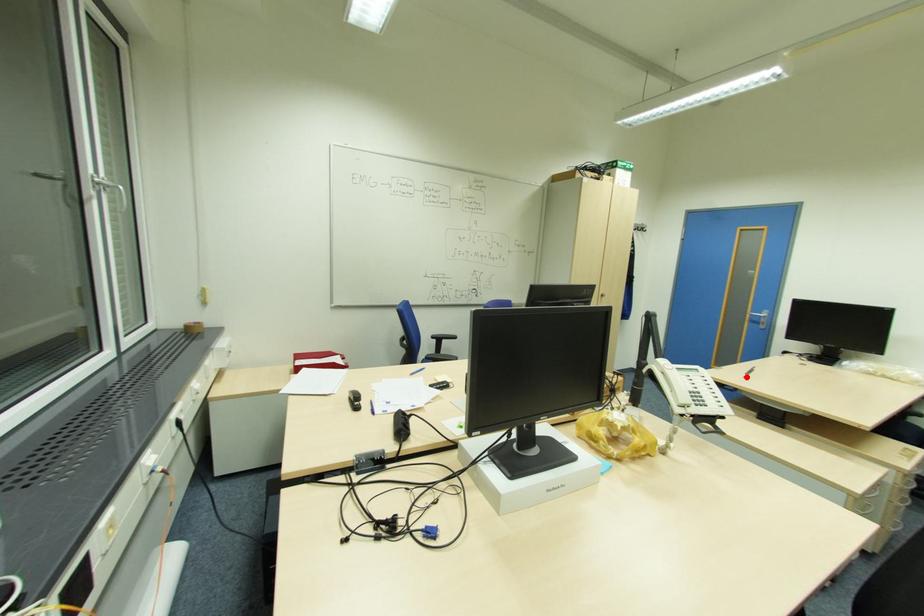
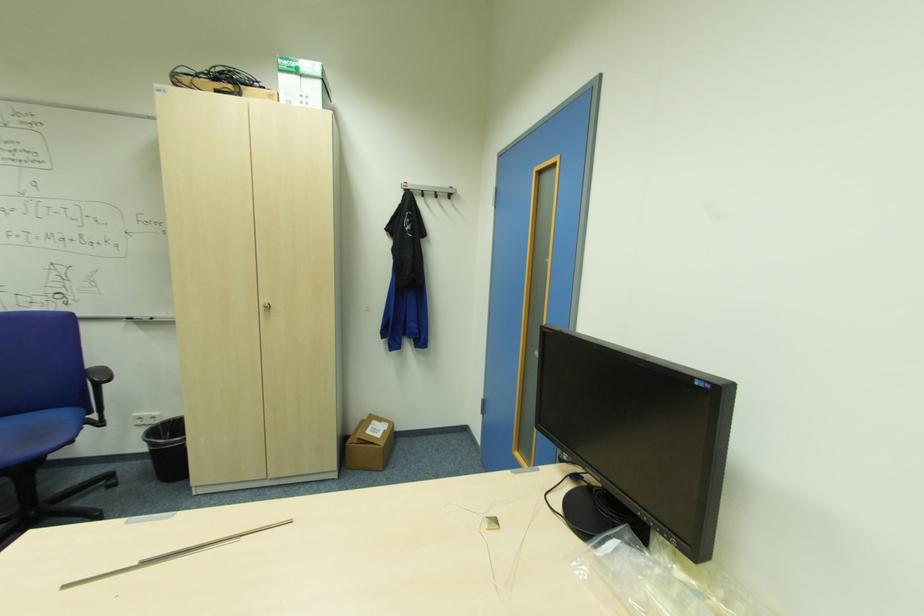
Find the pixel in the second image that matches the highlighted location in the first image.

(63, 589)